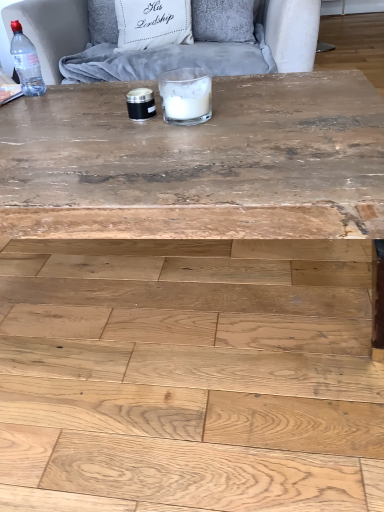
The image size is (384, 512). Identify the location of free space in front of transparent plastic bottle at top left. (36, 108).